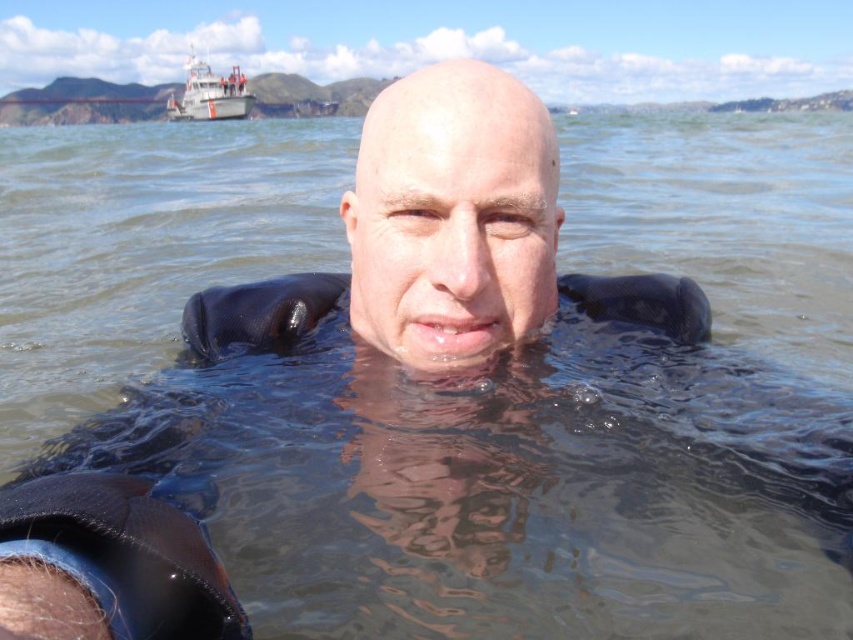
You are a photographer trying to capture a shot of the matte black head at center and the white matte boat at upper left. Based on their positions, which object should you place on the right side of your camera frame?

The matte black head at center is to the right of the white matte boat at upper left, so you should place the matte black head at center on the right side of your camera frame.

You are a photographer trying to capture the matte black head at center in the image. The camera is positioned at the origin point. The scene has a coordinate system where the bottom left corner is the origin. The coordinates of the matte black head at center are at point (x=451, y=216). To ensure the head is in focus, you need to adjust the camera lens to the correct focal length. If the focal length required to focus on an object at the center point is 50mm, what focal length should you use for the matte?

The coordinates of the matte black head at center are at point (x=451, y=216). Since the center point of the image would be at coordinates 0.5, 0.5, the matte black head at center is slightly to the left and below the true center. However, the focal length required to focus on an object at the center point is 50mm, so the same focal length of 50mm should be used for the matte black head at center as it is positioned near the central area of the image.